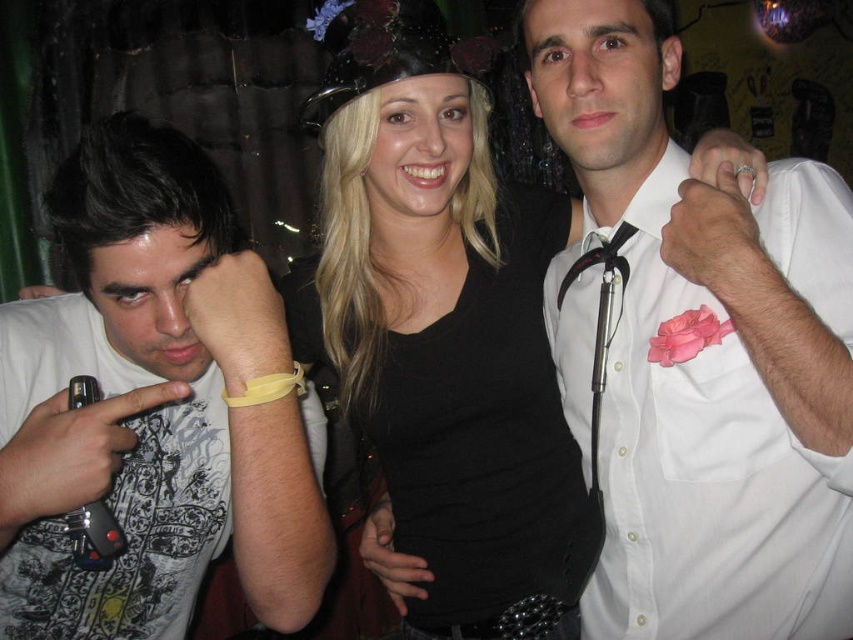
Question: Observing the image, what is the correct spatial positioning of white satin shirt at center in reference to white printed t-shirt at left?

Choices:
 (A) above
 (B) below

Answer: (A)

Question: Is white satin shirt at center positioned at the back of white printed t-shirt at left?

Choices:
 (A) no
 (B) yes

Answer: (B)

Question: Which of these objects is positioned closest to the white printed t-shirt at left?

Choices:
 (A) black matte dress at center
 (B) white satin shirt at center

Answer: (A)

Question: Is white satin shirt at center thinner than black matte dress at center?

Choices:
 (A) yes
 (B) no

Answer: (A)

Question: Estimate the real-world distances between objects in this image. Which object is closer to the white printed t-shirt at left?

Choices:
 (A) white satin shirt at center
 (B) black matte dress at center

Answer: (B)

Question: Which of the following is the farthest from the observer?

Choices:
 (A) white printed t-shirt at left
 (B) black matte dress at center

Answer: (B)